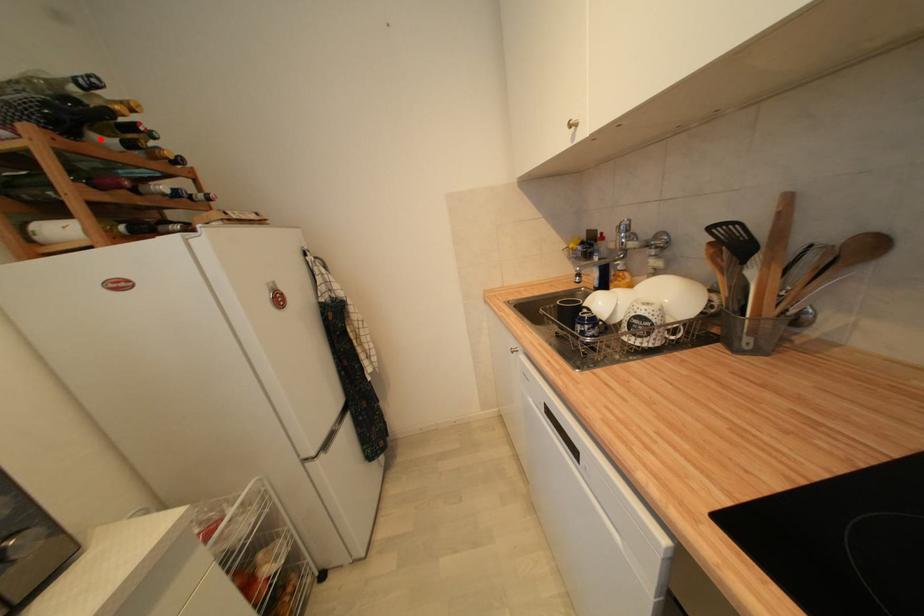
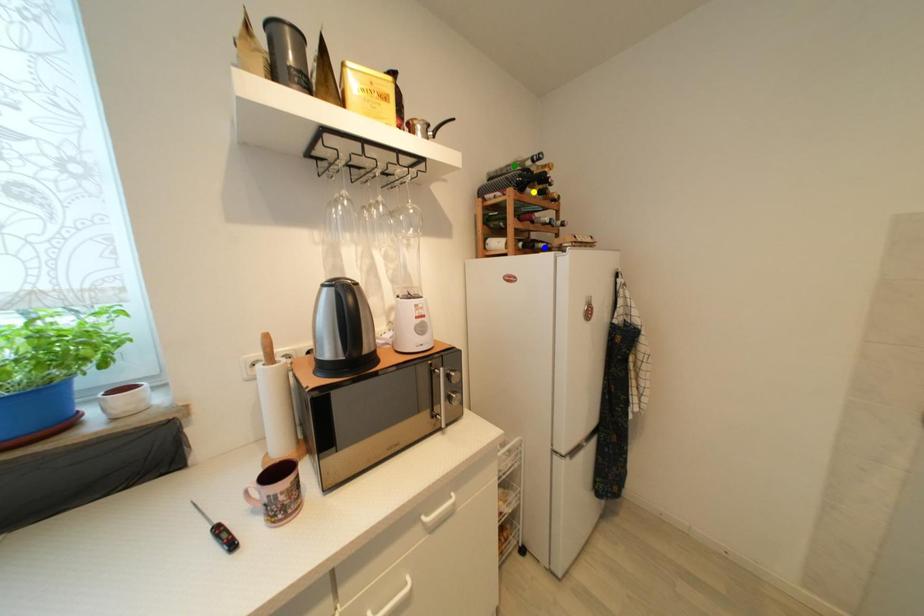
Question: I am providing you with two images of the same scene from different viewpoints. A red point is marked on the first image. You are given multiple points on the second image. Which point in image 2 represents the same 3d spot as the red point in image 1?

Choices:
 (A) green point
 (B) blue point
 (C) yellow point

Answer: (C)